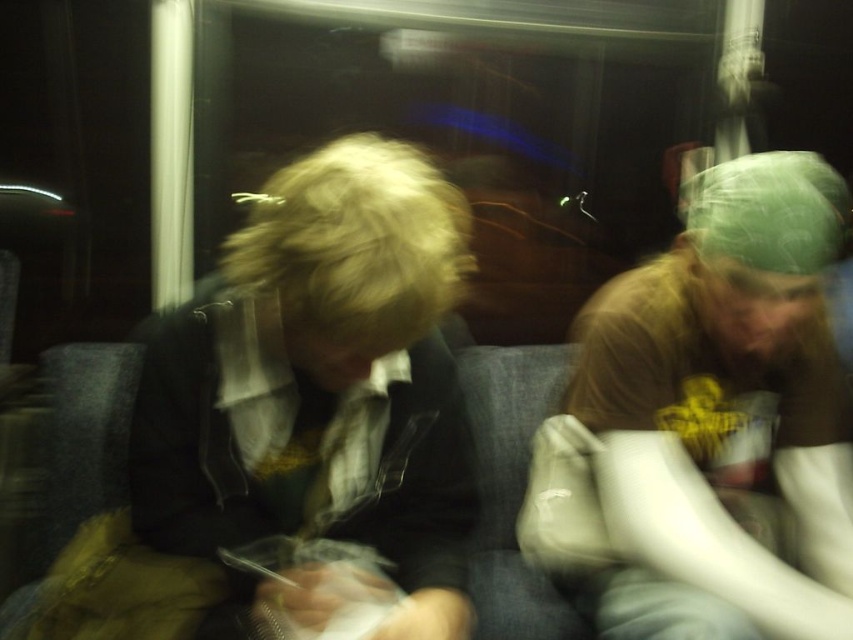
Is green fabric cap at right further to camera compared to matte black jacket at center?

Yes, green fabric cap at right is further from the viewer.

The height and width of the screenshot is (640, 853). Describe the element at coordinates (709, 424) in the screenshot. I see `green fabric cap at right` at that location.

Find the location of `green fabric cap at right`. green fabric cap at right is located at coordinates pos(709,424).